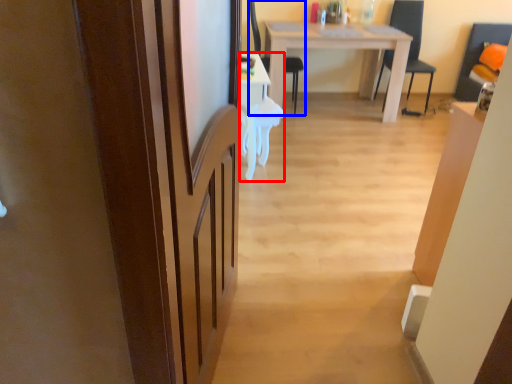
Question: Which object appears closest to the camera in this image, desk (highlighted by a red box) or chair (highlighted by a blue box)?

Choices:
 (A) desk
 (B) chair

Answer: (A)